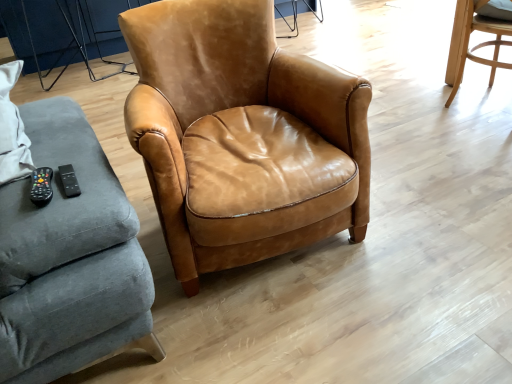
What are the coordinates of `unoccupied region to the right of cognac leather armchair at center, the 2th chair when ordered from right to left` in the screenshot? It's located at (429, 193).